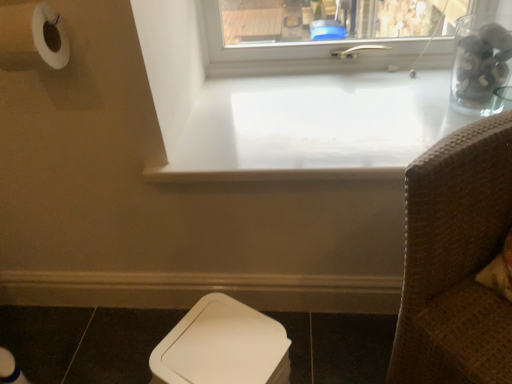
I want to click on free space that is to the left of transparent glass jar at upper right, so click(x=403, y=114).